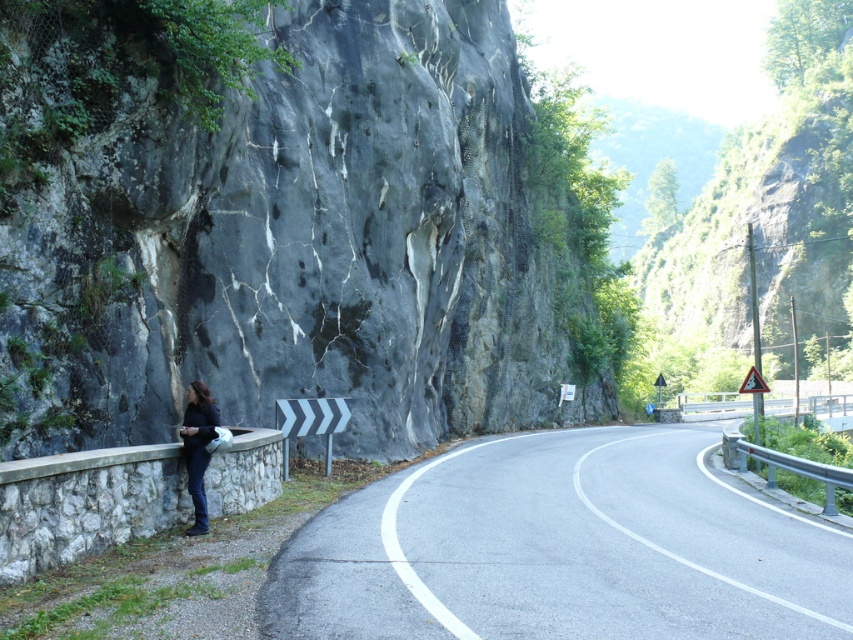
Question: Does black asphalt road at center have a lesser width compared to stone at left?

Choices:
 (A) no
 (B) yes

Answer: (A)

Question: Does black asphalt road at center have a greater width compared to stone at left?

Choices:
 (A) no
 (B) yes

Answer: (B)

Question: Estimate the real-world distances between objects in this image. Which object is farther from the stone at left?

Choices:
 (A) black asphalt road at center
 (B) metallic gray barrier at right

Answer: (B)

Question: Which of the following is the farthest from the observer?

Choices:
 (A) stone at left
 (B) black asphalt road at center

Answer: (A)

Question: Among these objects, which one is farthest from the camera?

Choices:
 (A) dark blue jeans at left
 (B) black asphalt road at center

Answer: (A)

Question: Does black asphalt road at center appear under stone at left?

Choices:
 (A) no
 (B) yes

Answer: (B)